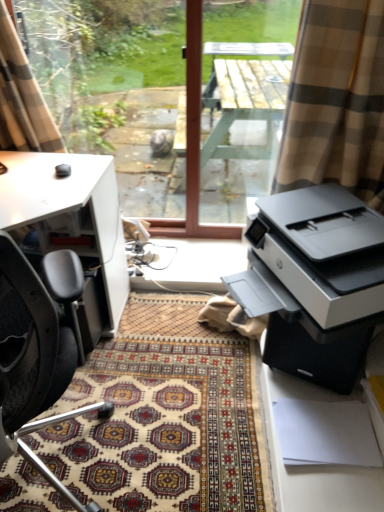
Question: Does matte black printer at right have a greater height compared to wooden table at center?

Choices:
 (A) no
 (B) yes

Answer: (A)

Question: Is matte black printer at right to the left of wooden table at center from the viewer's perspective?

Choices:
 (A) yes
 (B) no

Answer: (B)

Question: Is matte black printer at right far away from wooden table at center?

Choices:
 (A) yes
 (B) no

Answer: (A)

Question: From a real-world perspective, is matte black printer at right physically above wooden table at center?

Choices:
 (A) no
 (B) yes

Answer: (A)

Question: From a real-world perspective, is matte black printer at right below wooden table at center?

Choices:
 (A) yes
 (B) no

Answer: (A)

Question: Would you say white matte desk at left is inside or outside matte black printer at right?

Choices:
 (A) inside
 (B) outside

Answer: (B)

Question: From the image's perspective, is white matte desk at left positioned above or below matte black printer at right?

Choices:
 (A) below
 (B) above

Answer: (A)

Question: Considering their positions, is white matte desk at left located in front of or behind matte black printer at right?

Choices:
 (A) front
 (B) behind

Answer: (B)

Question: In terms of size, does white matte desk at left appear bigger or smaller than matte black printer at right?

Choices:
 (A) big
 (B) small

Answer: (A)

Question: Is white matte desk at left bigger or smaller than transparent glass window at center?

Choices:
 (A) big
 (B) small

Answer: (A)

Question: Based on their positions, is white matte desk at left located to the left or right of transparent glass window at center?

Choices:
 (A) left
 (B) right

Answer: (A)

Question: From a real-world perspective, is white matte desk at left physically located above or below transparent glass window at center?

Choices:
 (A) above
 (B) below

Answer: (B)

Question: Is point (x=100, y=305) closer or farther from the camera than point (x=1, y=137)?

Choices:
 (A) farther
 (B) closer

Answer: (B)

Question: Considering their positions, is patterned carpet at center located in front of or behind beige plaid curtain at upper left?

Choices:
 (A) front
 (B) behind

Answer: (A)

Question: Is patterned carpet at center spatially inside beige plaid curtain at upper left, or outside of it?

Choices:
 (A) inside
 (B) outside

Answer: (B)